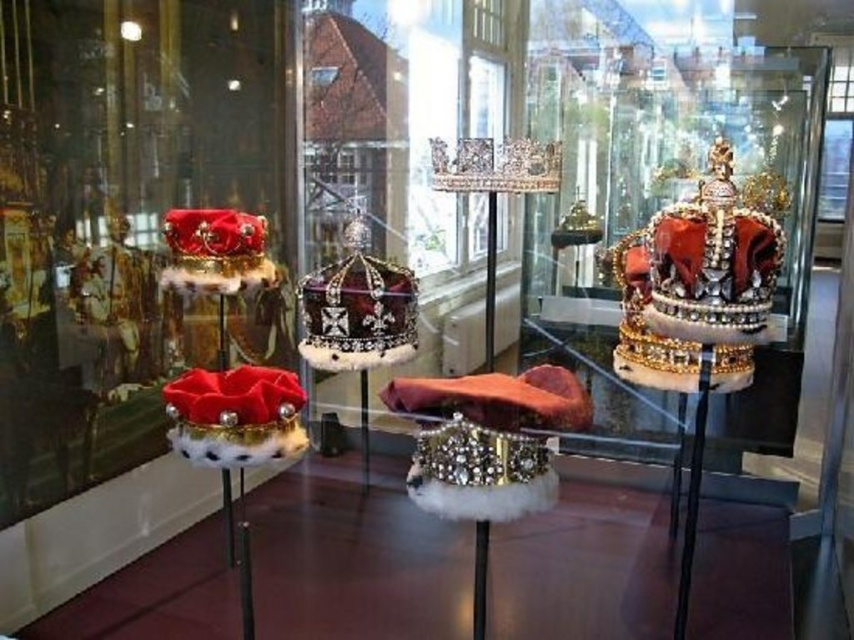
Is shiny gold crown at right bigger than satin black crown at center?

Yes.

Does shiny gold crown at right have a greater height compared to satin black crown at center?

Indeed, shiny gold crown at right has a greater height compared to satin black crown at center.

Does point (640, 273) come behind point (361, 296)?

That is False.

Locate an element on the screen. This screenshot has height=640, width=854. shiny gold crown at right is located at coordinates (697, 289).